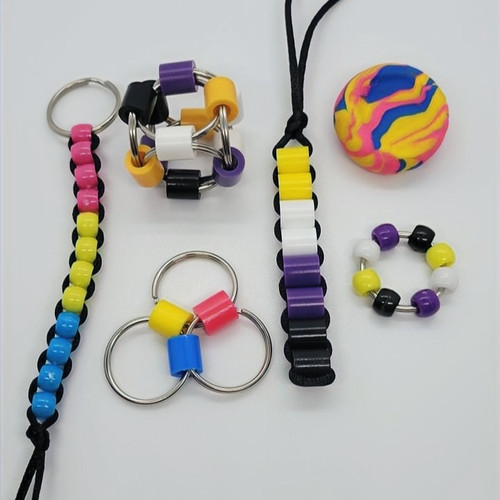
Identify the location of sculptures. (193, 141), (204, 311).